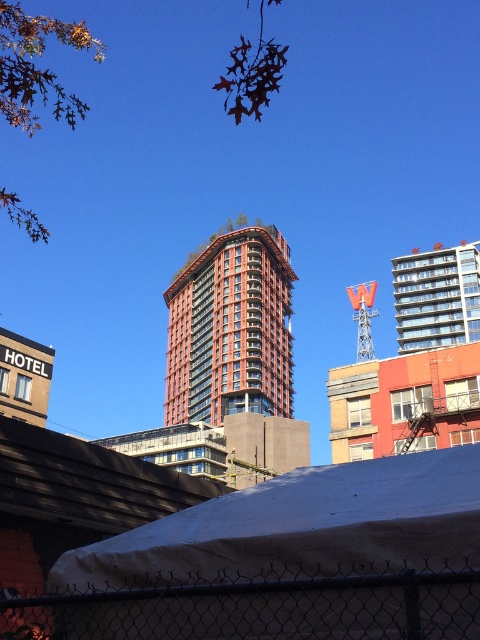
Can you confirm if chain link fence at lower center is positioned to the right of red brick building at center?

Indeed, chain link fence at lower center is positioned on the right side of red brick building at center.

Which is above, chain link fence at lower center or red brick building at center?

red brick building at center is higher up.

Which is behind, point (252, 630) or point (244, 328)?

Point (244, 328)

The width and height of the screenshot is (480, 640). What are the coordinates of `chain link fence at lower center` in the screenshot? It's located at (261, 609).

The image size is (480, 640). I want to click on red brick building at center, so click(230, 330).

Is point (283, 307) more distant than point (457, 285)?

Yes, point (283, 307) is farther from viewer.

This screenshot has height=640, width=480. In order to click on red brick building at center in this screenshot , I will do `click(230, 330)`.

Which is in front, point (371, 618) or point (404, 280)?

Point (371, 618)

The image size is (480, 640). Find the location of `chain link fence at lower center`. chain link fence at lower center is located at coordinates (261, 609).